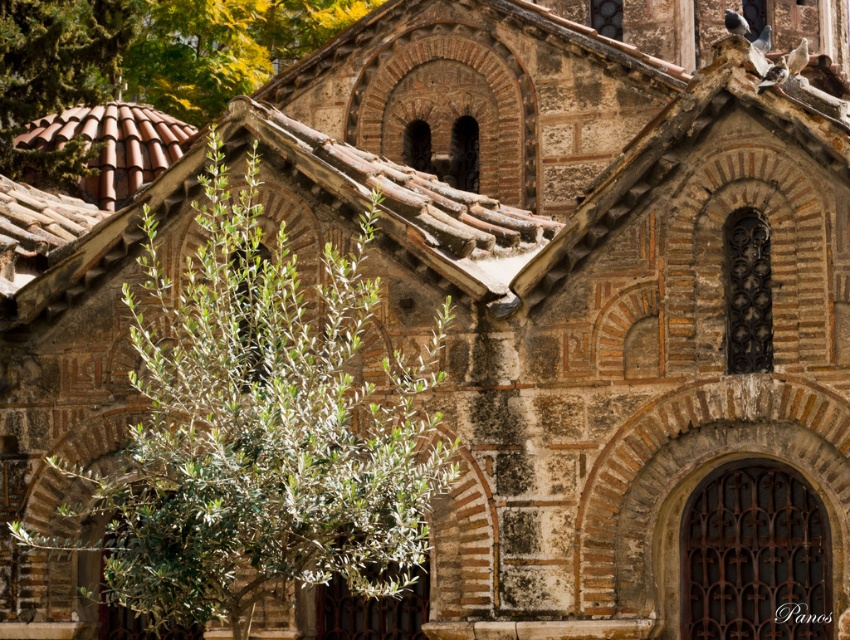
Is green leafy plant at left bigger than green leafy tree at upper left?

Incorrect, green leafy plant at left is not larger than green leafy tree at upper left.

Looking at this image, who is lower down, green leafy plant at left or green leafy tree at upper left?

green leafy plant at left is lower down.

Where is `green leafy plant at left`? green leafy plant at left is located at coordinates (258, 429).